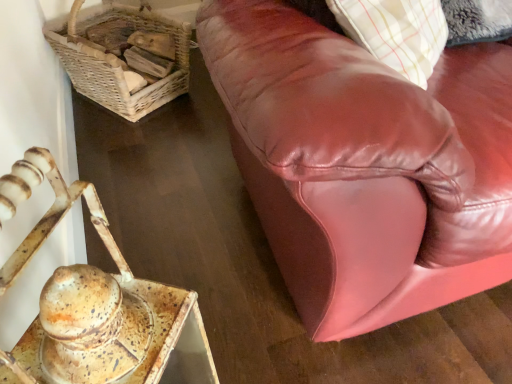
Question: Is woven wicker basket at upper left taller than rusty metal tray at lower left?

Choices:
 (A) yes
 (B) no

Answer: (B)

Question: Can you confirm if woven wicker basket at upper left is wider than rusty metal tray at lower left?

Choices:
 (A) yes
 (B) no

Answer: (A)

Question: Is woven wicker basket at upper left facing away from rusty metal tray at lower left?

Choices:
 (A) yes
 (B) no

Answer: (B)

Question: Is woven wicker basket at upper left not within rusty metal tray at lower left?

Choices:
 (A) yes
 (B) no

Answer: (A)

Question: Is woven wicker basket at upper left positioned far away from rusty metal tray at lower left?

Choices:
 (A) yes
 (B) no

Answer: (A)

Question: Does point (271, 140) appear closer or farther from the camera than point (159, 18)?

Choices:
 (A) closer
 (B) farther

Answer: (A)

Question: From a real-world perspective, is shiny brown leather couch at upper right physically located above or below woven wicker basket at upper left?

Choices:
 (A) below
 (B) above

Answer: (A)

Question: Based on their positions, is shiny brown leather couch at upper right located to the left or right of woven wicker basket at upper left?

Choices:
 (A) left
 (B) right

Answer: (B)

Question: From the image's perspective, is shiny brown leather couch at upper right positioned above or below woven wicker basket at upper left?

Choices:
 (A) above
 (B) below

Answer: (B)

Question: Would you say rusty metal tray at lower left is to the left or to the right of shiny brown leather couch at upper right in the picture?

Choices:
 (A) left
 (B) right

Answer: (A)

Question: Is rusty metal tray at lower left spatially inside shiny brown leather couch at upper right, or outside of it?

Choices:
 (A) inside
 (B) outside

Answer: (B)

Question: Is rusty metal tray at lower left in front of or behind shiny brown leather couch at upper right in the image?

Choices:
 (A) behind
 (B) front

Answer: (B)

Question: Is point (90, 302) positioned closer to the camera than point (463, 269)?

Choices:
 (A) farther
 (B) closer

Answer: (B)

Question: In the image, is woven wicker basket at upper left positioned in front of or behind rusty metal tray at lower left?

Choices:
 (A) front
 (B) behind

Answer: (B)

Question: From a real-world perspective, is woven wicker basket at upper left positioned above or below rusty metal tray at lower left?

Choices:
 (A) below
 (B) above

Answer: (A)